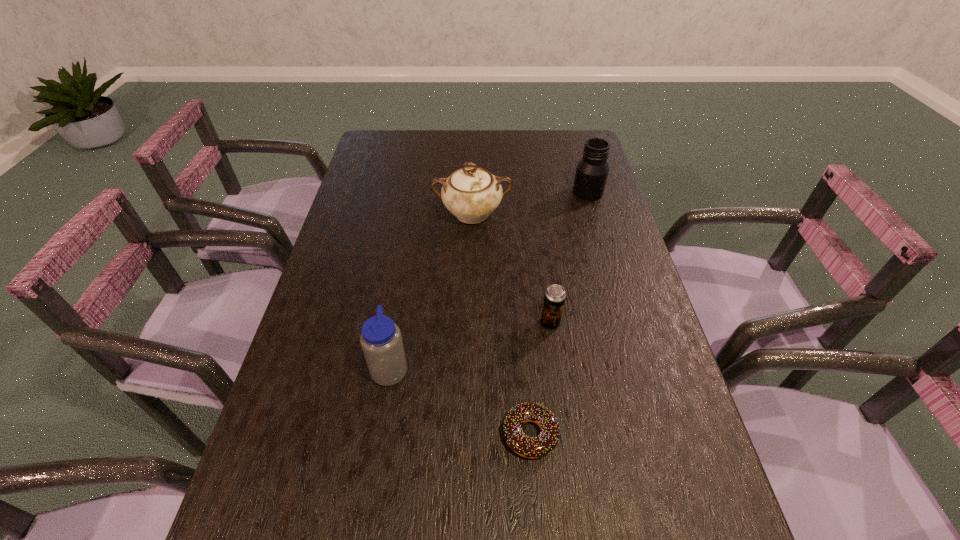
Identify the location of free spot that satisfies the following two spatial constraints: 1. on the front side of the chinaware; 2. with a carrying loop on the side of the fourth farthest object. The width and height of the screenshot is (960, 540). (468, 367).

The width and height of the screenshot is (960, 540). In order to click on free region that satisfies the following two spatial constraints: 1. on the back side of the fourth tallest object; 2. on the left side of the nearest object in this screenshot , I will do `click(521, 323)`.

Where is `vacant space that satisfies the following two spatial constraints: 1. with a carrying loop on the side of the nearest object; 2. on the right side of the water bottle`? vacant space that satisfies the following two spatial constraints: 1. with a carrying loop on the side of the nearest object; 2. on the right side of the water bottle is located at coordinates (379, 434).